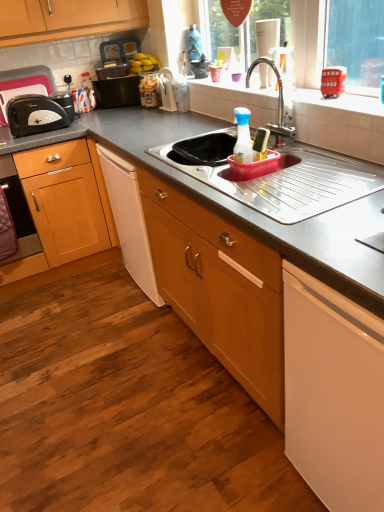
Question: From a real-world perspective, does white matte dishwasher at lower right stand above matte black toaster at left?

Choices:
 (A) yes
 (B) no

Answer: (B)

Question: Is white matte dishwasher at lower right positioned with its back to matte black toaster at left?

Choices:
 (A) no
 (B) yes

Answer: (A)

Question: Does white matte dishwasher at lower right have a greater height compared to matte black toaster at left?

Choices:
 (A) no
 (B) yes

Answer: (B)

Question: Does white matte dishwasher at lower right have a greater width compared to matte black toaster at left?

Choices:
 (A) no
 (B) yes

Answer: (B)

Question: Is white matte dishwasher at lower right far away from matte black toaster at left?

Choices:
 (A) yes
 (B) no

Answer: (A)

Question: Is the surface of white matte dishwasher at lower right in direct contact with matte black toaster at left?

Choices:
 (A) no
 (B) yes

Answer: (A)

Question: Is white matte dishwasher at lower right to the left of white plastic dish rack at upper center, marked as the first appliance in a right-to-left arrangement, from the viewer's perspective?

Choices:
 (A) no
 (B) yes

Answer: (A)

Question: From the image's perspective, is white matte dishwasher at lower right located above white plastic dish rack at upper center, marked as the first appliance in a right-to-left arrangement?

Choices:
 (A) yes
 (B) no

Answer: (B)

Question: Does white matte dishwasher at lower right turn towards white plastic dish rack at upper center, which appears as the second appliance when viewed from the left?

Choices:
 (A) yes
 (B) no

Answer: (B)

Question: From a real-world perspective, is white matte dishwasher at lower right over white plastic dish rack at upper center, which appears as the second appliance when viewed from the left?

Choices:
 (A) no
 (B) yes

Answer: (A)

Question: From a real-world perspective, is white matte dishwasher at lower right located beneath white plastic dish rack at upper center, marked as the first appliance in a right-to-left arrangement?

Choices:
 (A) no
 (B) yes

Answer: (B)

Question: Is white plastic dish rack at upper center, marked as the first appliance in a right-to-left arrangement, inside white matte dishwasher at lower right?

Choices:
 (A) yes
 (B) no

Answer: (B)

Question: From the image's perspective, is black plastic toaster at left, placed as the 2th appliance when sorted from right to left, located above white plastic dish rack at upper center, which appears as the second appliance when viewed from the left?

Choices:
 (A) yes
 (B) no

Answer: (A)